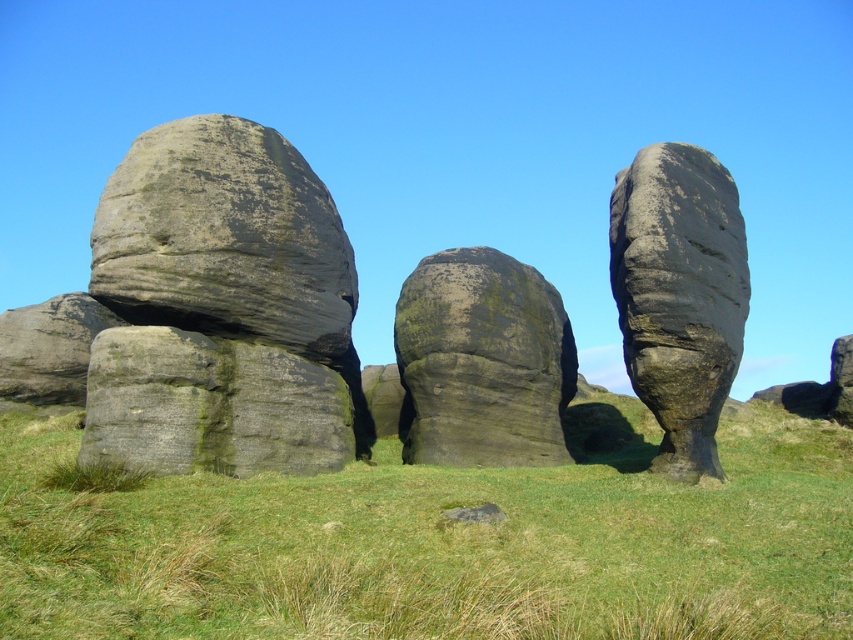
Who is higher up, green grass at center or green mossy rock at center?

green mossy rock at center

Is point (822, 442) farther from camera compared to point (494, 412)?

Yes, it is behind point (494, 412).

Between point (839, 477) and point (463, 260), which one is positioned in front?

Positioned in front is point (839, 477).

Locate an element on the screen. The image size is (853, 640). green grass at center is located at coordinates (438, 545).

Image resolution: width=853 pixels, height=640 pixels. Describe the element at coordinates (219, 307) in the screenshot. I see `gray stone boulder at center` at that location.

Measure the distance between point (215, 381) and camera.

The distance of point (215, 381) from camera is 13.61 meters.

Does point (102, 426) come in front of point (720, 368)?

Yes.

The image size is (853, 640). I want to click on gray stone boulder at center, so click(219, 307).

Describe the element at coordinates (438, 545) in the screenshot. I see `green grass at center` at that location.

Is green grass at center bigger than gray stone boulder at center?

Correct, green grass at center is larger in size than gray stone boulder at center.

What do you see at coordinates (438, 545) in the screenshot? This screenshot has height=640, width=853. I see `green grass at center` at bounding box center [438, 545].

The image size is (853, 640). Find the location of `green grass at center`. green grass at center is located at coordinates (438, 545).